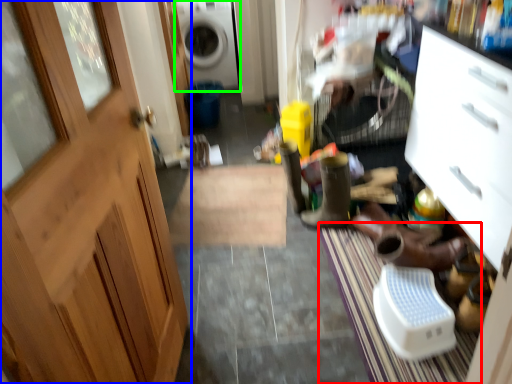
Question: Which object is positioned closest to doormat (highlighted by a red box)? Select from door (highlighted by a blue box) and washing machine (highlighted by a green box).

Choices:
 (A) door
 (B) washing machine

Answer: (A)